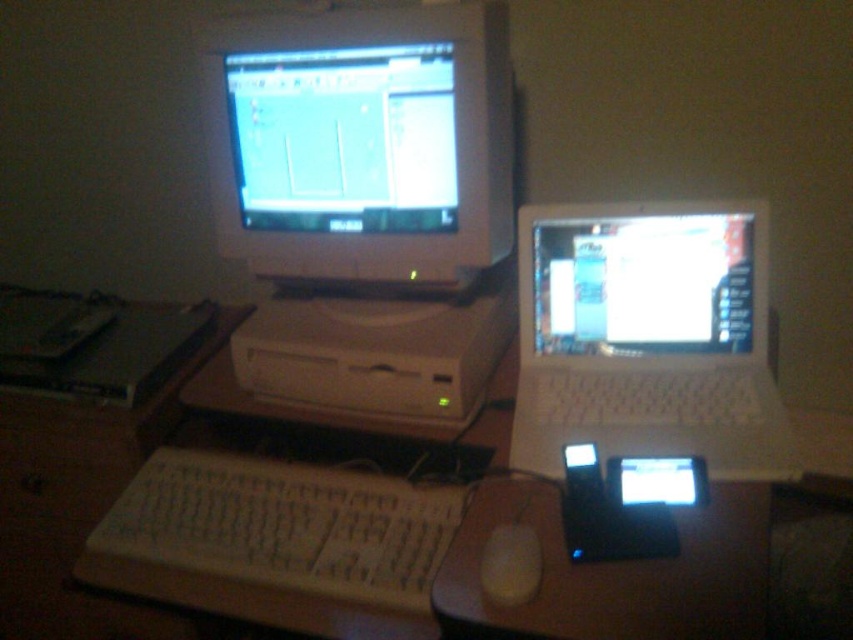
Question: Which object is closer to the camera taking this photo?

Choices:
 (A) white plastic laptop at right
 (B) white plastic computer desk at center
 (C) white glossy laptop at center

Answer: (B)

Question: Based on their relative distances, which object is nearer to the white plastic keyboard at center?

Choices:
 (A) white plastic computer desk at center
 (B) white plastic laptop at right

Answer: (A)

Question: Which object is the farthest from the white glossy monitor at upper center?

Choices:
 (A) white plastic keyboard at center
 (B) white plastic mouse at center
 (C) white plastic laptop at right

Answer: (B)

Question: Does white plastic laptop at right appear on the left side of white glossy laptop at center?

Choices:
 (A) no
 (B) yes

Answer: (B)

Question: Does white glossy laptop at center come behind white plastic mouse at center?

Choices:
 (A) yes
 (B) no

Answer: (A)

Question: Does white plastic computer desk at center lie in front of white glossy laptop at center?

Choices:
 (A) no
 (B) yes

Answer: (B)